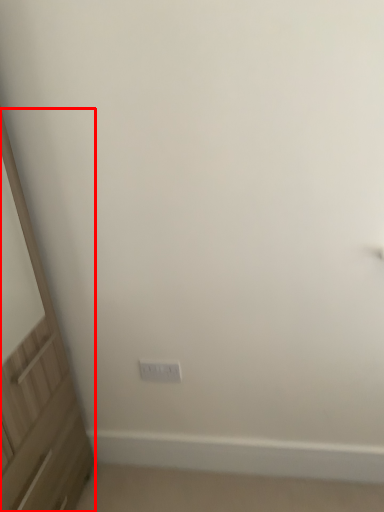
Question: From the image's perspective, where is screen door (annotated by the red box) located relative to electric outlet?

Choices:
 (A) below
 (B) above

Answer: (B)